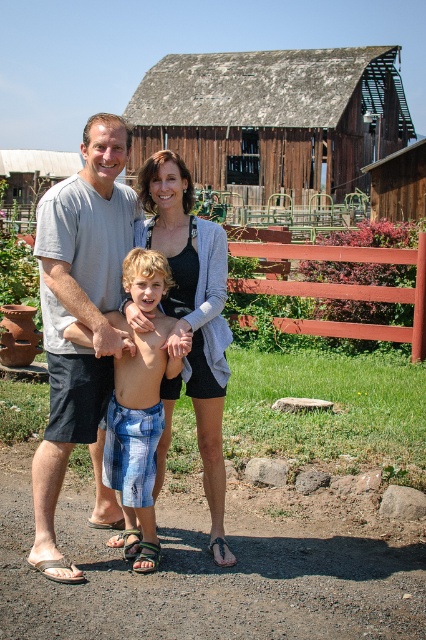
Is weathered wood barn at upper center to the left of gray cotton shirt at center from the viewer's perspective?

Incorrect, weathered wood barn at upper center is not on the left side of gray cotton shirt at center.

Looking at this image, does weathered wood barn at upper center have a greater height compared to gray cotton shirt at center?

Yes.

Does point (232, 147) come farther from viewer compared to point (69, 237)?

Yes, it is behind point (69, 237).

Where is `weathered wood barn at upper center`? The image size is (426, 640). weathered wood barn at upper center is located at coordinates (273, 116).

Can you confirm if brown leather sandal at lower left is wider than black leather sandal at lower center?

Yes, brown leather sandal at lower left is wider than black leather sandal at lower center.

Does brown leather sandal at lower left come in front of black leather sandal at lower center?

That is True.

In order to click on brown leather sandal at lower left in this screenshot , I will do `click(55, 566)`.

Who is more distant from viewer, (206, 296) or (120, 426)?

Point (206, 296)

Looking at this image, which is below, matte gray sweater at center or blue plaid shorts at center?

Positioned lower is blue plaid shorts at center.

This screenshot has width=426, height=640. What do you see at coordinates (189, 314) in the screenshot?
I see `matte gray sweater at center` at bounding box center [189, 314].

Find the location of a particular element. matte gray sweater at center is located at coordinates (189, 314).